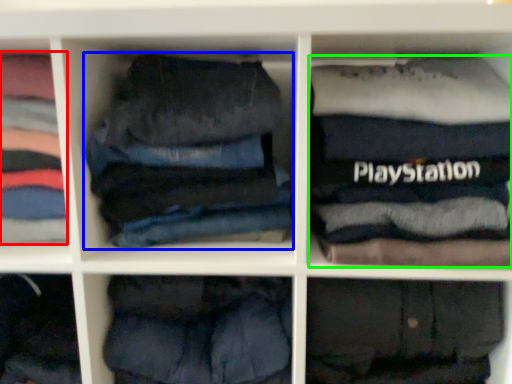
Question: Based on their relative distances, which object is nearer to clothing (highlighted by a red box)? Choose from trousers (highlighted by a blue box) and clothing (highlighted by a green box).

Choices:
 (A) trousers
 (B) clothing

Answer: (A)